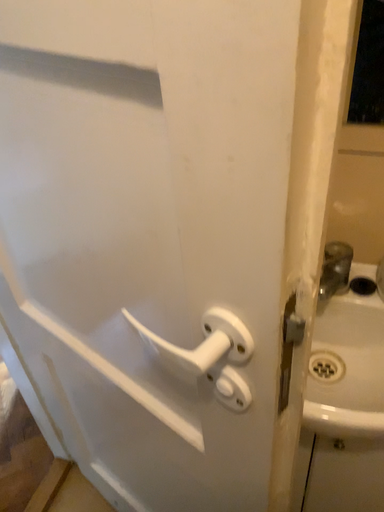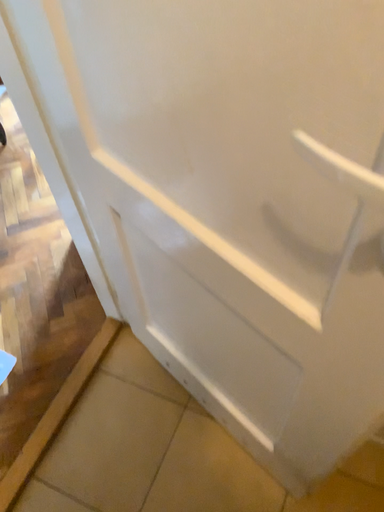
Question: Which way did the camera rotate in the video?

Choices:
 (A) rotated upward
 (B) rotated downward

Answer: (B)